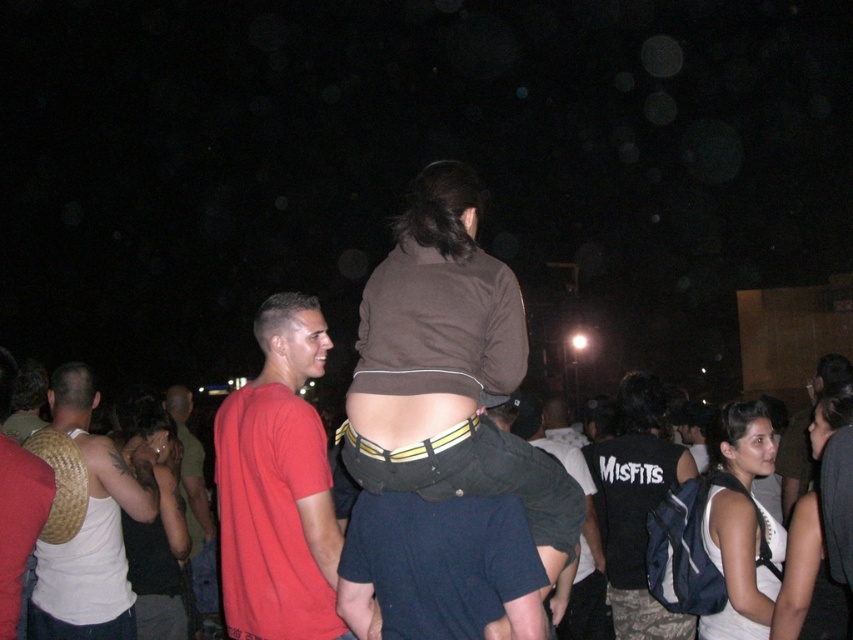
Is matte red t-shirt at center positioned before matte brown wicker basket at left?

No, matte red t-shirt at center is behind matte brown wicker basket at left.

Is point (328, 572) less distant than point (21, 497)?

No, it is not.

Find the location of a particular element. The width and height of the screenshot is (853, 640). matte red t-shirt at center is located at coordinates (277, 486).

Between black cotton t-shirt at lower right and matte black tank top at lower left, which one appears on the right side from the viewer's perspective?

From the viewer's perspective, black cotton t-shirt at lower right appears more on the right side.

Which is above, black cotton t-shirt at lower right or matte black tank top at lower left?

Positioned higher is matte black tank top at lower left.

This screenshot has height=640, width=853. What do you see at coordinates (636, 504) in the screenshot? I see `black cotton t-shirt at lower right` at bounding box center [636, 504].

Locate an element on the screen. Image resolution: width=853 pixels, height=640 pixels. black cotton t-shirt at lower right is located at coordinates (636, 504).

Based on the photo, does white woven bag at back left lie behind white fabric backpack at lower right?

Yes, it is behind white fabric backpack at lower right.

Does point (57, 392) lie behind point (762, 449)?

Yes, it is.

Identify the location of white woven bag at back left. Image resolution: width=853 pixels, height=640 pixels. [x=91, y=525].